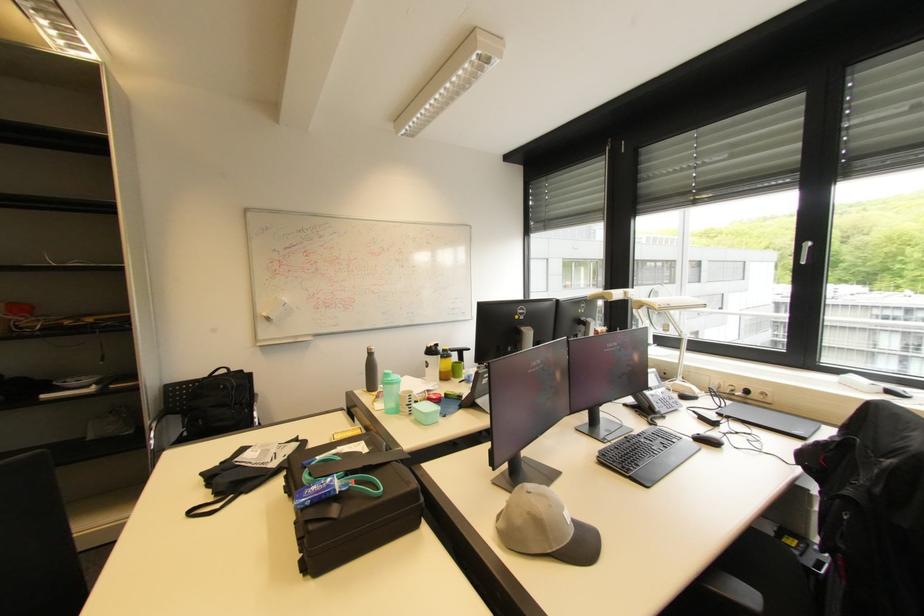
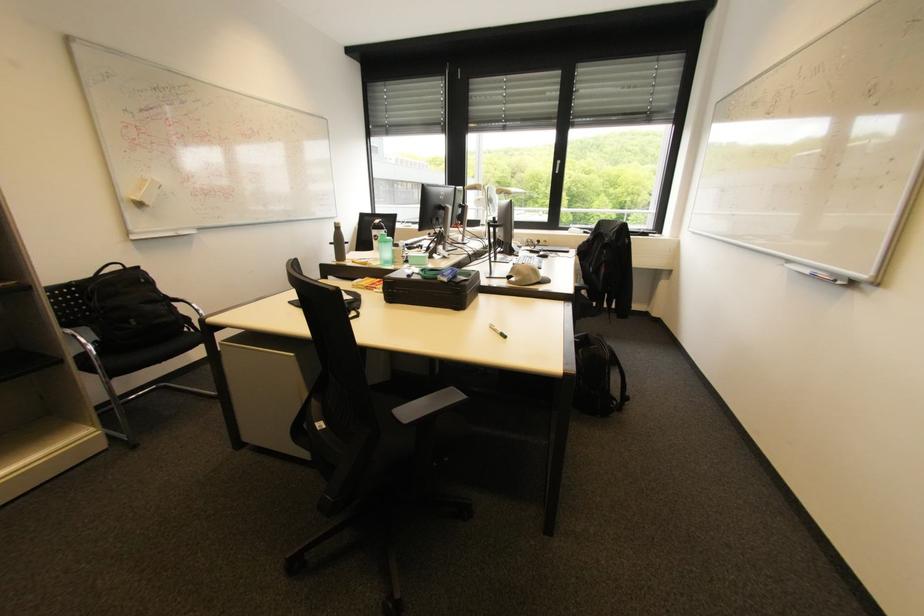
Where in the second image is the point corresponding to (x=226, y=387) from the first image?

(148, 281)